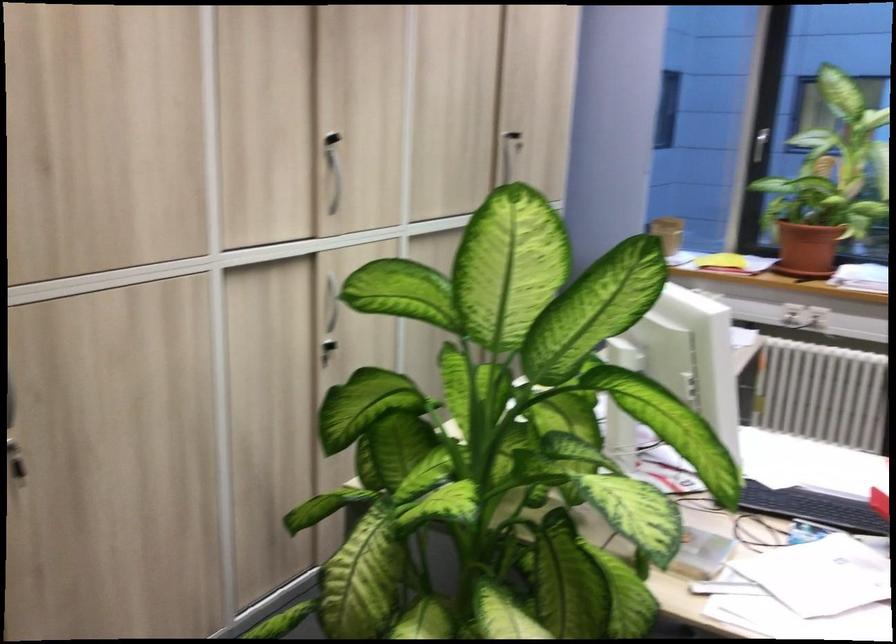
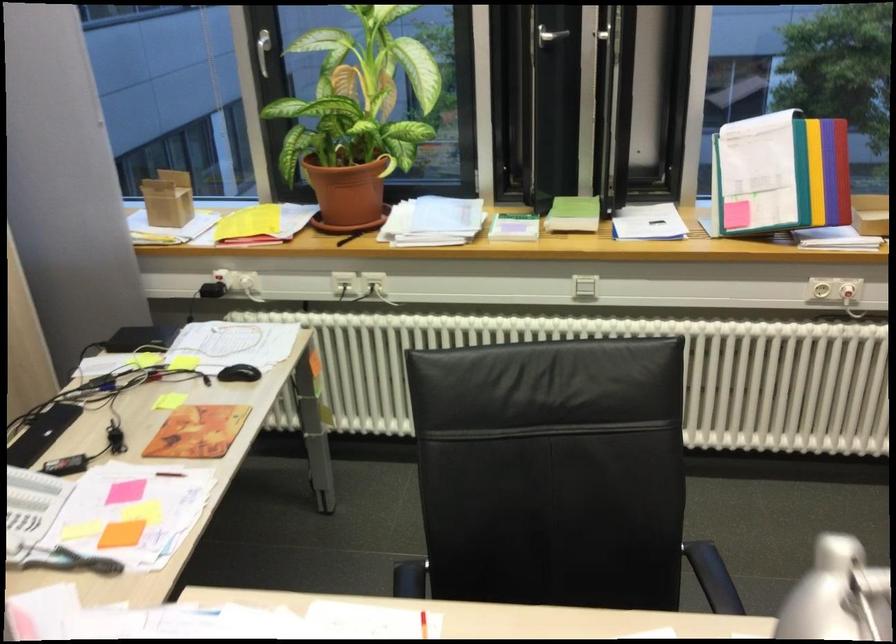
In a continuous first-person perspective shot, in which direction is the camera moving?

The cameraman moved toward right, forward.